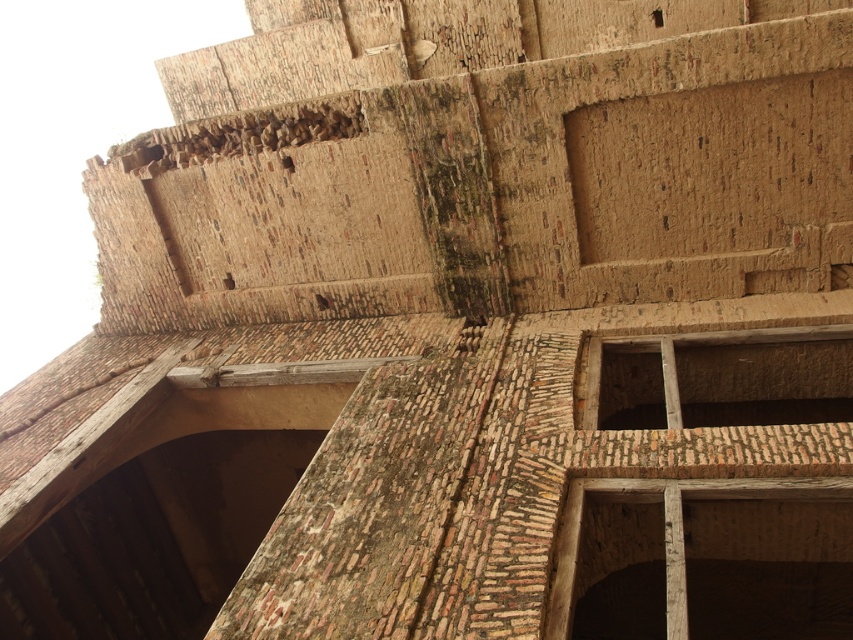
Describe the element at coordinates (720, 378) in the screenshot. I see `wooden frame at upper center` at that location.

Is point (651, 378) positioned after point (670, 605)?

That is True.

Which is behind, point (807, 420) or point (711, 486)?

Positioned behind is point (807, 420).

Locate an element on the screen. The image size is (853, 640). wooden frame at upper center is located at coordinates (720, 378).